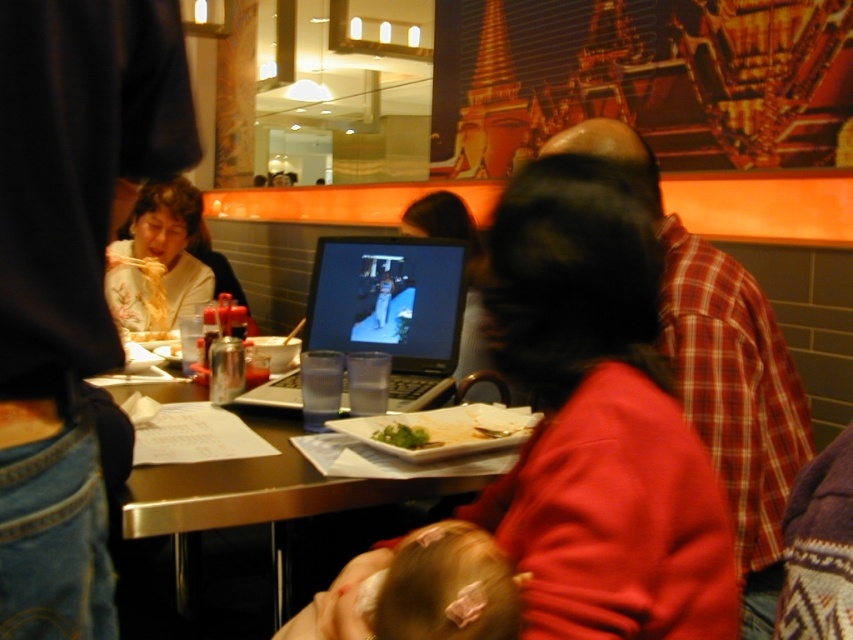
Can you confirm if matte black laptop at left is positioned to the right of green leafy vegetable at center?

In fact, matte black laptop at left is to the left of green leafy vegetable at center.

Does point (125, 64) come closer to viewer compared to point (409, 448)?

Yes, point (125, 64) is closer to viewer.

Locate an element on the screen. Image resolution: width=853 pixels, height=640 pixels. matte black laptop at left is located at coordinates (68, 276).

Between plaid shirt at center and silver metallic laptop at center, which one appears on the right side from the viewer's perspective?

Positioned to the right is plaid shirt at center.

Is plaid shirt at center above silver metallic laptop at center?

Actually, plaid shirt at center is below silver metallic laptop at center.

Does point (764, 484) come farther from viewer compared to point (346, 260)?

That is False.

Where is `plaid shirt at center`? The width and height of the screenshot is (853, 640). plaid shirt at center is located at coordinates (720, 369).

Is silver metallic laptop at center wider than yellow noodles at left?

Yes.

Is point (392, 346) more distant than point (158, 337)?

No, it is not.

Locate an element on the screen. silver metallic laptop at center is located at coordinates (392, 308).